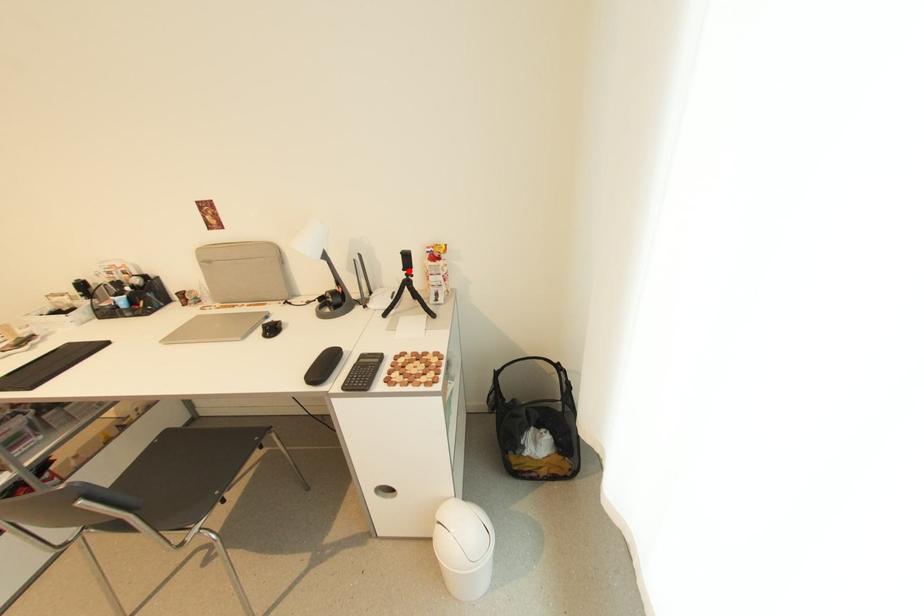
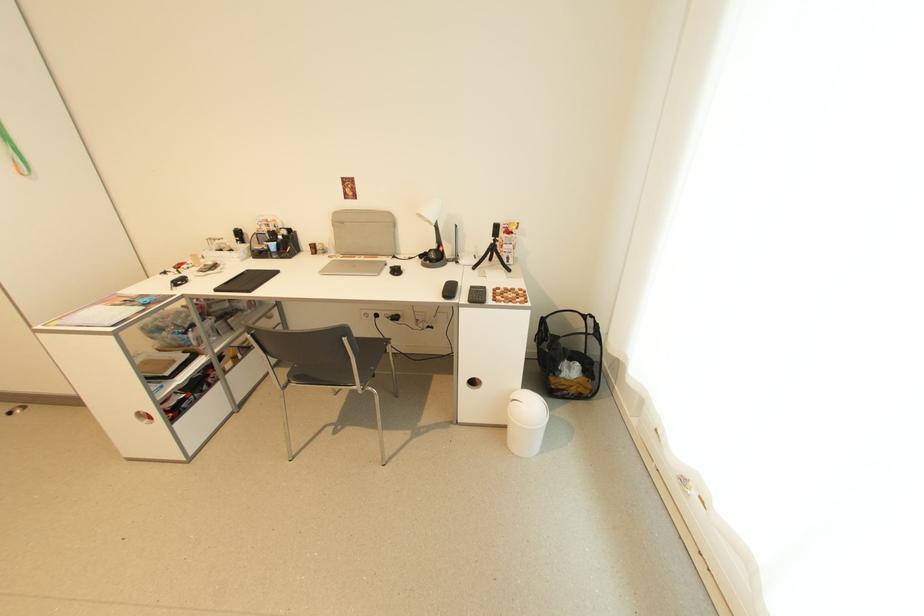
The point at the highlighted location is marked in the first image. Where is the corresponding point in the second image?

(497, 238)